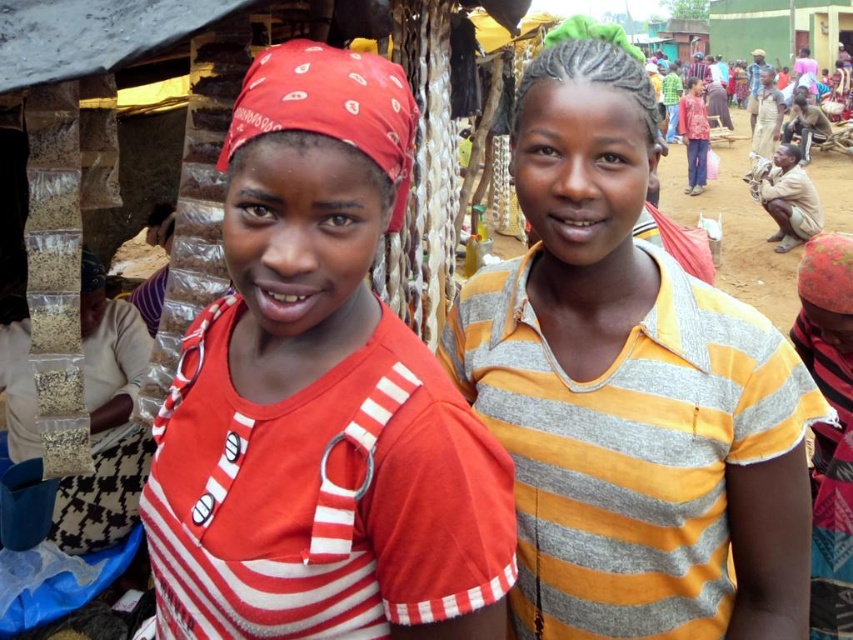
You are a photographer at the market and want to capture both the matte red bandana at left and the yellow striped shirt at center in a single frame. Which object should you focus on first to ensure both are in the frame?

The matte red bandana at left has a lesser height compared to the yellow striped shirt at center. Therefore, focus on the yellow striped shirt at center first to ensure both are in the frame.

You are standing at the market entrance and see two points in the image. The first point is at coordinates point (277, 314) and the second is at point (590, 556). Which point is nearer to you?

Point (277, 314) is closer to the viewer than point (590, 556).